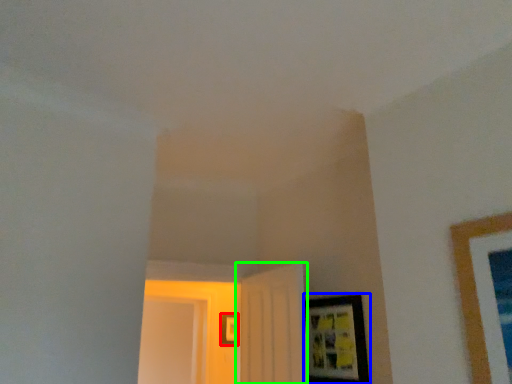
Question: Based on their relative distances, which object is farther from picture frame (highlighted by a red box)? Choose from picture frame (highlighted by a blue box) and door (highlighted by a green box).

Choices:
 (A) picture frame
 (B) door

Answer: (A)